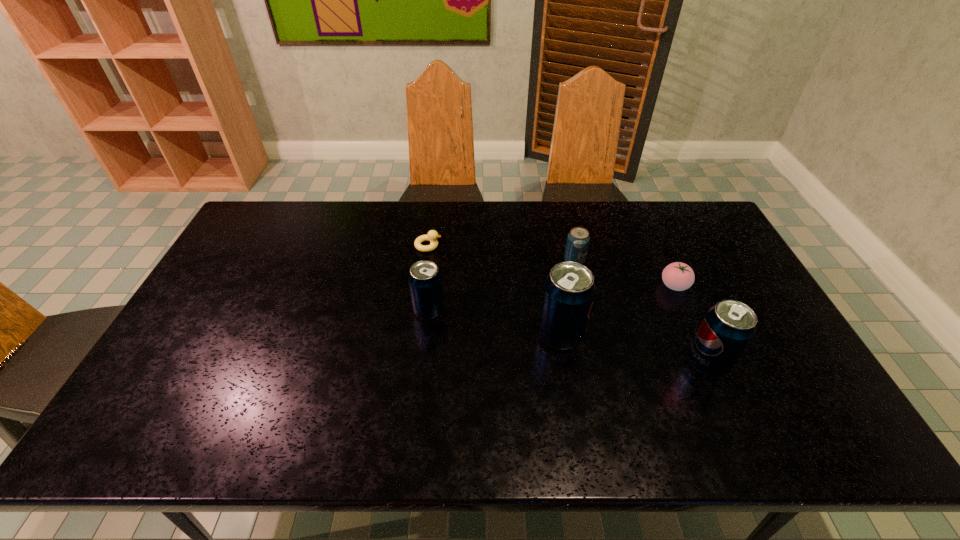
At what (x,y) coordinates should I click in order to perform the action: click on vacant region located on the front of the third tallest object. Please return your answer as a coordinate pair (x, y). Looking at the image, I should click on (423, 357).

You are a GUI agent. You are given a task and a screenshot of the screen. Output one action in this format:
    pyautogui.click(x=<x>, y=<y>)
    Task: Click on the blank space located on the right of the rightmost pop soda
    
    Given the screenshot: What is the action you would take?
    pyautogui.click(x=778, y=363)

I want to click on free space located at the beak of the duckling, so click(x=518, y=246).

Locate an element on the screen. The image size is (960, 540). free space located 0.090m on the back of the fourth nearest object is located at coordinates (661, 256).

Find the location of `free space located on the left of the second farthest object`. free space located on the left of the second farthest object is located at coordinates tap(449, 261).

Identify the location of object that is at the far edge. This screenshot has height=540, width=960. 432,235.

Find the location of `object located in the near edge section of the desktop`. object located in the near edge section of the desktop is located at coordinates (728, 327).

Where is `free spot at the far edge of the desktop`? This screenshot has width=960, height=540. free spot at the far edge of the desktop is located at coordinates (474, 222).

The image size is (960, 540). Find the location of `vacant space at the near edge`. vacant space at the near edge is located at coordinates (269, 382).

In order to click on free space at the left edge of the desktop in this screenshot , I will do `click(212, 330)`.